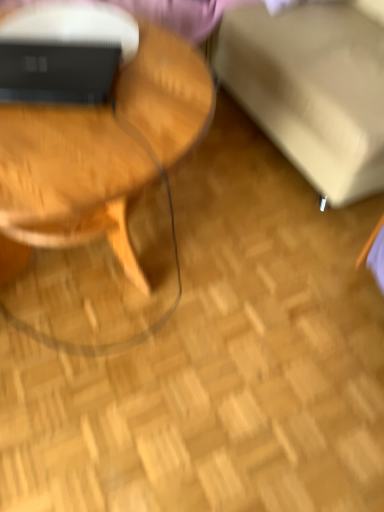
In order to click on blank space situated above woodenmaterial/texturecoffee table at left (from a real-world perspective) in this screenshot , I will do `click(94, 89)`.